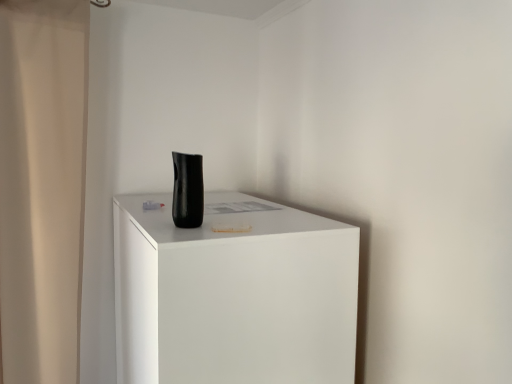
What are the coordinates of `free space to the back side of black matte vase at center` in the screenshot? It's located at (211, 216).